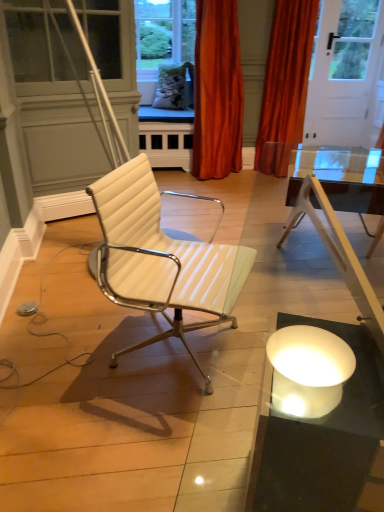
Question: From a real-world perspective, is white leather chair at center positioned above or below orange velvet curtain at upper center, acting as the first curtain starting from the left?

Choices:
 (A) below
 (B) above

Answer: (A)

Question: From the image's perspective, is white leather chair at center located above or below orange velvet curtain at upper center, which is the second curtain from right to left?

Choices:
 (A) below
 (B) above

Answer: (A)

Question: Which is nearer to the white leather chair at center?

Choices:
 (A) orange velvet curtain at upper right, acting as the 1th curtain starting from the right
 (B) orange velvet curtain at upper center, which is the second curtain from right to left

Answer: (B)

Question: Considering the real-world distances, which object is closest to the orange velvet curtain at upper right, acting as the 1th curtain starting from the right?

Choices:
 (A) white leather chair at center
 (B) orange velvet curtain at upper center, acting as the first curtain starting from the left

Answer: (B)